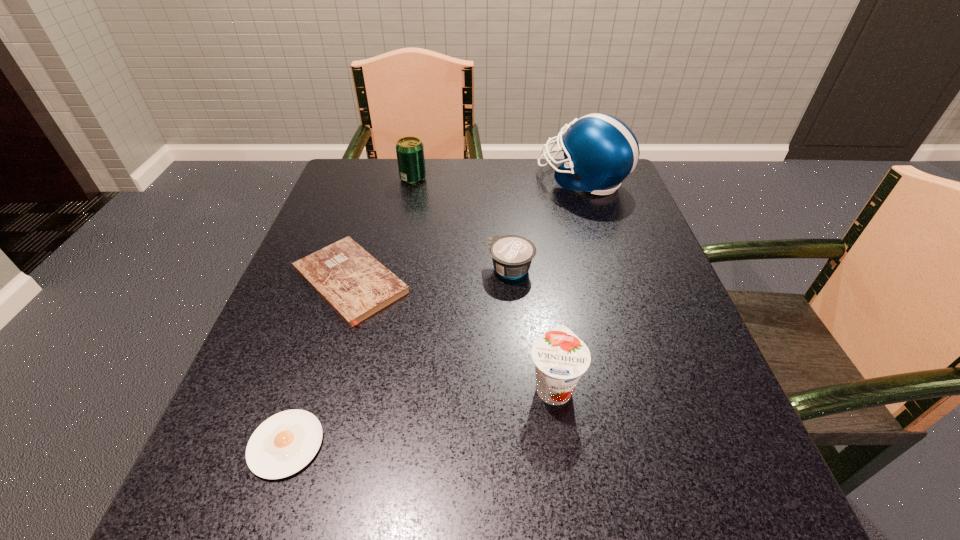
I want to click on egg yolk at the left edge, so pos(282,445).

Identify the location of object that is at the right edge. This screenshot has height=540, width=960. (600, 151).

Identify the location of object at the near left corner. This screenshot has width=960, height=540. (282, 445).

Identify the location of object that is at the far right corner. Image resolution: width=960 pixels, height=540 pixels. (600, 151).

I want to click on vacant area at the far edge, so click(x=498, y=166).

The image size is (960, 540). What are the coordinates of `vacant space at the near edge of the desktop` in the screenshot? It's located at (488, 515).

At what (x,y) coordinates should I click in order to perform the action: click on free point at the left edge. Please return your answer as a coordinate pair (x, y). Image resolution: width=960 pixels, height=540 pixels. Looking at the image, I should click on (379, 222).

Locate an element on the screen. The width and height of the screenshot is (960, 540). free space at the right edge of the desktop is located at coordinates (694, 346).

The height and width of the screenshot is (540, 960). Identify the location of vacant space at the far left corner. (329, 191).

Identify the location of vacant area at the far right corner of the desktop. (579, 205).